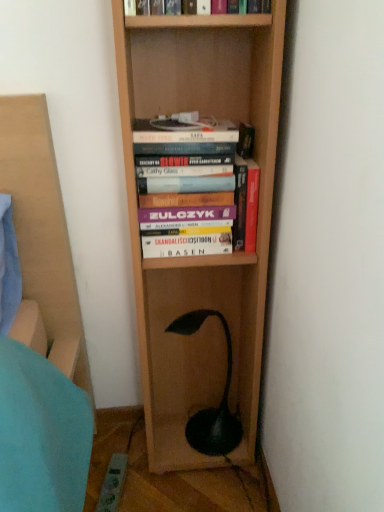
Question: From a real-world perspective, is hardcover book at center, the first book from the bottom, located higher than hardcover book at upper center, the 3th book from the bottom?

Choices:
 (A) yes
 (B) no

Answer: (B)

Question: Is hardcover book at center, the first book from the bottom, thinner than hardcover book at upper center, the 3th book from the bottom?

Choices:
 (A) no
 (B) yes

Answer: (A)

Question: Is hardcover book at upper center, placed as the 1th book when sorted from top to bottom, a part of hardcover book at center, the first book from the bottom?

Choices:
 (A) no
 (B) yes

Answer: (A)

Question: Does hardcover book at center, the first book from the bottom, have a greater width compared to hardcover book at upper center, the 3th book from the bottom?

Choices:
 (A) no
 (B) yes

Answer: (B)

Question: Is the position of hardcover book at center, the first book from the bottom, less distant than that of hardcover book at upper center, placed as the 1th book when sorted from top to bottom?

Choices:
 (A) yes
 (B) no

Answer: (B)

Question: Does hardcover book at center, acting as the 3th book starting from the top, have a smaller size compared to hardcover book at upper center, the 3th book from the bottom?

Choices:
 (A) yes
 (B) no

Answer: (A)

Question: Can you confirm if hardcover book at upper center, the 3th book from the bottom, is taller than green matte lamp at lower center?

Choices:
 (A) yes
 (B) no

Answer: (B)

Question: Is hardcover book at upper center, placed as the 1th book when sorted from top to bottom, oriented towards green matte lamp at lower center?

Choices:
 (A) yes
 (B) no

Answer: (B)

Question: From a real-world perspective, does hardcover book at upper center, placed as the 1th book when sorted from top to bottom, sit lower than green matte lamp at lower center?

Choices:
 (A) no
 (B) yes

Answer: (A)

Question: From the image's perspective, is hardcover book at upper center, the 3th book from the bottom, over green matte lamp at lower center?

Choices:
 (A) no
 (B) yes

Answer: (B)

Question: From the image's perspective, is hardcover book at upper center, placed as the 1th book when sorted from top to bottom, located beneath green matte lamp at lower center?

Choices:
 (A) yes
 (B) no

Answer: (B)

Question: Is the position of hardcover book at upper center, placed as the 1th book when sorted from top to bottom, less distant than that of green matte lamp at lower center?

Choices:
 (A) yes
 (B) no

Answer: (A)

Question: Is hardcover book at center, the first book from the bottom, outside green matte lamp at lower center?

Choices:
 (A) yes
 (B) no

Answer: (A)